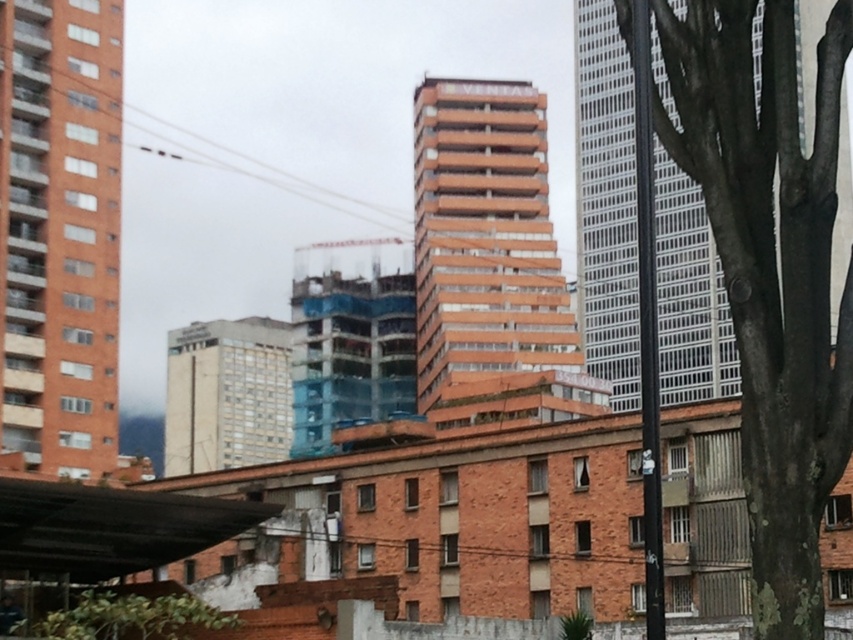
Question: Among these points, which one is farthest from the camera?

Choices:
 (A) (653, 472)
 (B) (161, 625)
 (C) (772, 273)

Answer: (B)

Question: Is green rough bark tree at right positioned before metallic silver pole at right?

Choices:
 (A) yes
 (B) no

Answer: (A)

Question: Can you confirm if green rough bark tree at right is thinner than green leafy tree at lower left?

Choices:
 (A) yes
 (B) no

Answer: (B)

Question: Can you confirm if green rough bark tree at right is positioned above metallic silver pole at right?

Choices:
 (A) no
 (B) yes

Answer: (A)

Question: Which of these objects is positioned closest to the green rough bark tree at right?

Choices:
 (A) metallic silver pole at right
 (B) green leafy tree at lower left

Answer: (A)

Question: Which object is farther from the camera taking this photo?

Choices:
 (A) green rough bark tree at right
 (B) green leafy tree at lower left
 (C) metallic silver pole at right

Answer: (B)